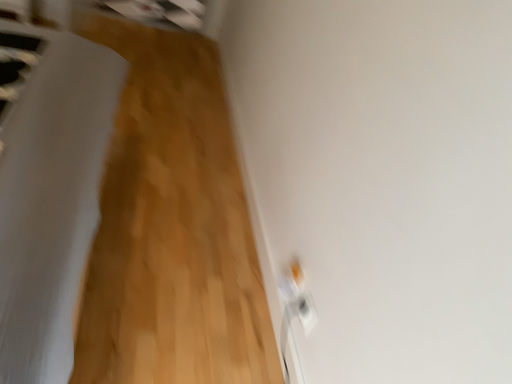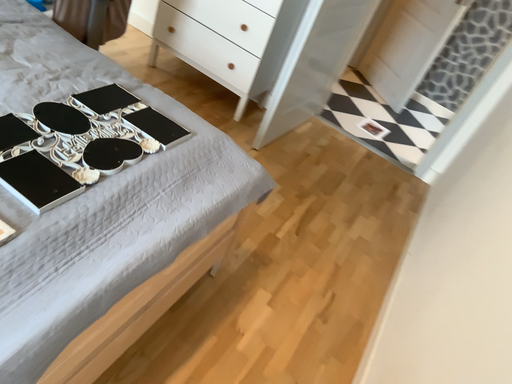
Question: Which way did the camera rotate in the video?

Choices:
 (A) rotated right
 (B) rotated left

Answer: (B)